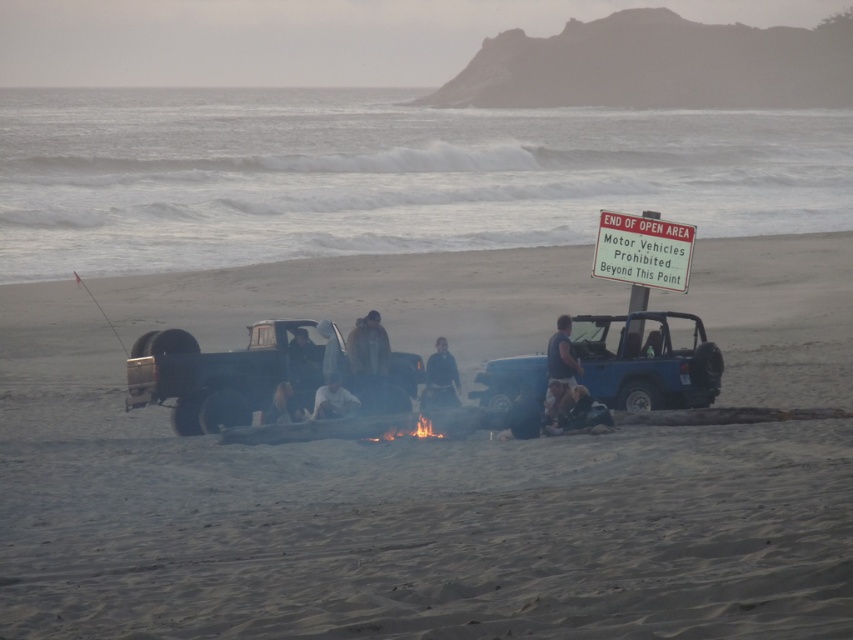
You are a drone operator trying to capture a photo of the blue matte jeep at center from above. Based on the scene description, what coordinates should you aim for to ensure the jeep is centered in the photo?

The blue matte jeep at center is located at coordinates point (647,364), so you should aim the drone at those coordinates to center the jeep in the photo.